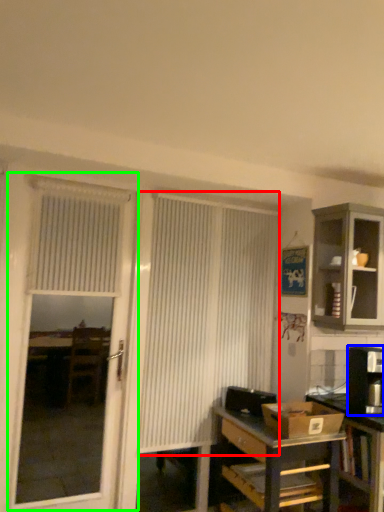
Question: Considering the real-world distances, which object is closest to curtain (highlighted by a red box)? appliance (highlighted by a blue box) or screen door (highlighted by a green box).

Choices:
 (A) appliance
 (B) screen door

Answer: (A)